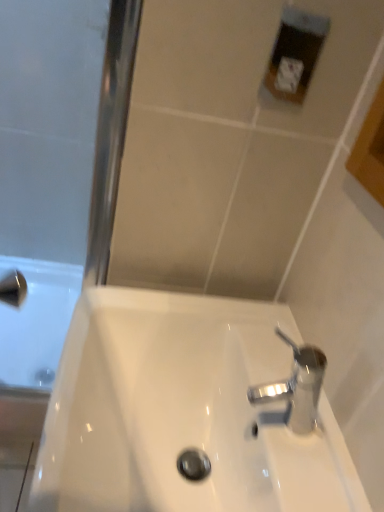
The image size is (384, 512). I want to click on white glossy sink at center, so click(x=182, y=412).

What do you see at coordinates (182, 412) in the screenshot?
I see `white glossy sink at center` at bounding box center [182, 412].

Describe the element at coordinates (296, 386) in the screenshot. I see `polished chrome tap at lower right` at that location.

Locate an element on the screen. The height and width of the screenshot is (512, 384). polished chrome tap at lower right is located at coordinates (296, 386).

Locate an element on the screen. The width and height of the screenshot is (384, 512). white glossy sink at center is located at coordinates point(182,412).

Is polished chrome tap at lower right at the right side of white glossy sink at center?

Yes, polished chrome tap at lower right is to the right of white glossy sink at center.

Between polished chrome tap at lower right and white glossy sink at center, which one is positioned behind?

Positioned behind is polished chrome tap at lower right.

Is point (317, 365) less distant than point (238, 403)?

Yes, it is in front of point (238, 403).

From the image's perspective, who appears lower, polished chrome tap at lower right or white glossy sink at center?

white glossy sink at center.

From a real-world perspective, who is located lower, polished chrome tap at lower right or white glossy sink at center?

white glossy sink at center, from a real-world perspective.

Which of these two, polished chrome tap at lower right or white glossy sink at center, is wider?

Wider between the two is white glossy sink at center.

Considering the sizes of polished chrome tap at lower right and white glossy sink at center in the image, is polished chrome tap at lower right taller or shorter than white glossy sink at center?

polished chrome tap at lower right is shorter than white glossy sink at center.

Between polished chrome tap at lower right and white glossy sink at center, which one has larger size?

white glossy sink at center.

Based on the photo, can white glossy sink at center be found inside polished chrome tap at lower right?

No, white glossy sink at center is not surrounded by polished chrome tap at lower right.

Is polished chrome tap at lower right in contact with white glossy sink at center?

No, polished chrome tap at lower right is not beside white glossy sink at center.

Is polished chrome tap at lower right oriented away from white glossy sink at center?

No, polished chrome tap at lower right is not facing the opposite direction of white glossy sink at center.

How much distance is there between polished chrome tap at lower right and white glossy sink at center?

polished chrome tap at lower right is 6.38 inches from white glossy sink at center.

What are the coordinates of `sink below the polished chrome tap at lower right (from a real-world perspective)` in the screenshot? It's located at (182, 412).

Between white glossy sink at center and polished chrome tap at lower right, which one appears on the left side from the viewer's perspective?

white glossy sink at center.

Considering the positions of objects white glossy sink at center and polished chrome tap at lower right in the image provided, who is in front, white glossy sink at center or polished chrome tap at lower right?

Positioned in front is white glossy sink at center.

Which point is more forward, (95, 463) or (259, 393)?

Positioned in front is point (95, 463).

From the image's perspective, is white glossy sink at center under polished chrome tap at lower right?

Yes, from the image's perspective, white glossy sink at center is below polished chrome tap at lower right.

From a real-world perspective, who is located higher, white glossy sink at center or polished chrome tap at lower right?

polished chrome tap at lower right.

Which object is wider, white glossy sink at center or polished chrome tap at lower right?

Wider between the two is white glossy sink at center.

Does white glossy sink at center have a lesser height compared to polished chrome tap at lower right?

No.

Is white glossy sink at center bigger or smaller than polished chrome tap at lower right?

white glossy sink at center is bigger than polished chrome tap at lower right.

Can we say white glossy sink at center lies outside polished chrome tap at lower right?

Indeed, white glossy sink at center is completely outside polished chrome tap at lower right.

Is white glossy sink at center directly adjacent to polished chrome tap at lower right?

white glossy sink at center is not next to polished chrome tap at lower right, and they're not touching.

Is white glossy sink at center turned away from polished chrome tap at lower right?

white glossy sink at center is not turned away from polished chrome tap at lower right.

What's the angular difference between white glossy sink at center and polished chrome tap at lower right's facing directions?

0.101 degrees separate the facing orientations of white glossy sink at center and polished chrome tap at lower right.

How distant is white glossy sink at center from polished chrome tap at lower right?

A distance of 6.38 inches exists between white glossy sink at center and polished chrome tap at lower right.

The height and width of the screenshot is (512, 384). I want to click on tap that appears on the right of white glossy sink at center, so click(x=296, y=386).

You are a GUI agent. You are given a task and a screenshot of the screen. Output one action in this format:
    pyautogui.click(x=<x>, y=<y>)
    Task: Click on the tap above the white glossy sink at center (from the image's perspective)
    This screenshot has width=384, height=512.
    Given the screenshot: What is the action you would take?
    pyautogui.click(x=296, y=386)

Find the location of a particular element. tap lying on the right of white glossy sink at center is located at coordinates (296, 386).